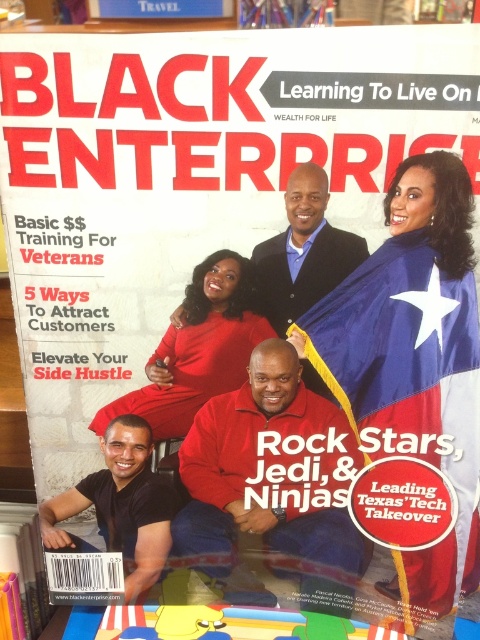
Is point (388, 316) closer to camera compared to point (149, 445)?

Yes, it is.

Does blueflag at right have a greater width compared to black matte shirt at lower left?

Correct, the width of blueflag at right exceeds that of black matte shirt at lower left.

Is point (364, 376) positioned behind point (115, 445)?

No.

Image resolution: width=480 pixels, height=640 pixels. Identify the location of blueflag at right. (409, 394).

The height and width of the screenshot is (640, 480). What do you see at coordinates (409, 394) in the screenshot?
I see `blueflag at right` at bounding box center [409, 394].

Is blueflag at right wider than red matte dress at center?

Indeed, blueflag at right has a greater width compared to red matte dress at center.

Does point (444, 388) come in front of point (173, 362)?

Yes, it is.

Where is `blueflag at right`? The image size is (480, 640). blueflag at right is located at coordinates (409, 394).

Is red matte sweater at center positioned in front of black matte shirt at lower left?

Yes, it is.

Does red matte sweater at center appear on the right side of black matte shirt at lower left?

Indeed, red matte sweater at center is positioned on the right side of black matte shirt at lower left.

Which is in front, point (291, 456) or point (152, 518)?

Positioned in front is point (291, 456).

Identify the location of red matte sweater at center. Image resolution: width=480 pixels, height=640 pixels. [x=283, y=474].